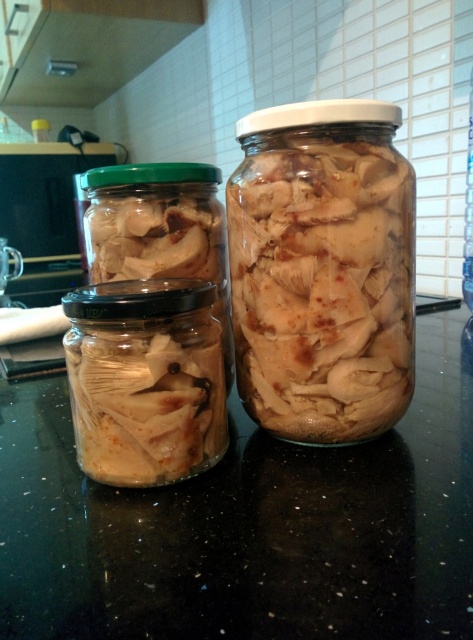
You are arranging items on a countertop and need to place a new item between the transparent glass jars at center and the clear glass bottle at center. Based on their positions, which item should you place the new item closer to?

The transparent glass jars at center is below the clear glass bottle at center. Therefore, you should place the new item closer to the transparent glass jars at center since it is lower than the clear glass bottle at center.

You are looking at the jars on the countertop. Which of the two points, point (251, 292) or point (472, 172), is closer to you?

Point (251, 292) is closer to the viewer than point (472, 172).

You are standing in a kitchen and want to grab the translucent glass jar at center. If your hand is 12 inches long, can you reach it without moving your body?

The translucent glass jar at center is 14.83 inches away from the viewer. Since your hand is only 12 inches long, you cannot reach it without moving your body.